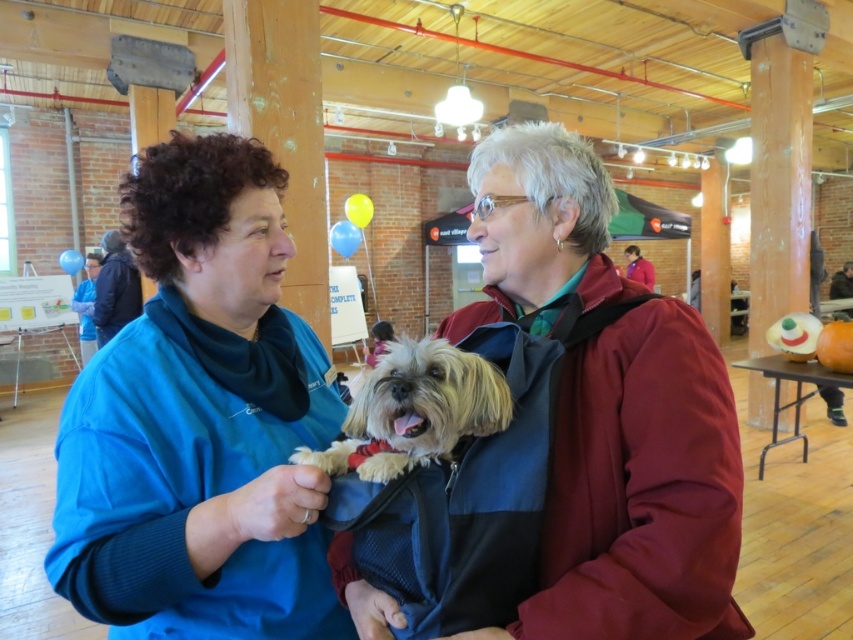
Which of these two, red fabric jacket at upper right or dark brown leather jacket at upper right, stands taller?

dark brown leather jacket at upper right is taller.

What do you see at coordinates (637, 266) in the screenshot? I see `red fabric jacket at upper right` at bounding box center [637, 266].

This screenshot has width=853, height=640. I want to click on red fabric jacket at upper right, so click(x=637, y=266).

Image resolution: width=853 pixels, height=640 pixels. I want to click on red fabric jacket at upper right, so click(x=637, y=266).

Does fluffy beige dog at center have a greater width compared to blue fleece jacket at upper left?

In fact, fluffy beige dog at center might be narrower than blue fleece jacket at upper left.

Is fluffy beige dog at center bigger than blue fleece jacket at upper left?

No, fluffy beige dog at center is not bigger than blue fleece jacket at upper left.

Which is behind, point (447, 397) or point (129, 300)?

The point (129, 300) is behind.

Where is `fluffy beige dog at center`? This screenshot has width=853, height=640. fluffy beige dog at center is located at coordinates (415, 410).

Does blue fleece jacket at upper left have a lesser height compared to blue fabric shirt at left?

Indeed, blue fleece jacket at upper left has a lesser height compared to blue fabric shirt at left.

Who is more forward, (112,296) or (91,256)?

Point (112,296) is in front.

The width and height of the screenshot is (853, 640). What are the coordinates of `blue fleece jacket at upper left` in the screenshot? It's located at (115, 289).